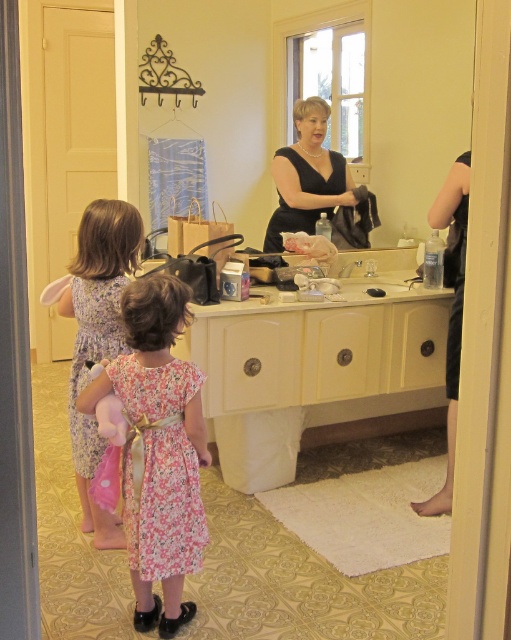
Does point (145, 280) come closer to viewer compared to point (280, 179)?

Yes, it is.

Who is positioned more to the left, floral cotton dress at center or black satin dress at center?

Positioned to the left is floral cotton dress at center.

Who is more forward, [160,472] or [314,154]?

Point [160,472] is in front.

This screenshot has height=640, width=511. Identify the location of floral cotton dress at center. (158, 449).

Who is shorter, floral fabric dress at center or floral fabric dress at left?

floral fabric dress at center

Identify the location of floral fabric dress at center. (159, 468).

From the picture: Between black glossy mirror at upper center and black matte dress at right, which one has more height?

With more height is black glossy mirror at upper center.

Is black glossy mirror at upper center positioned at the back of black matte dress at right?

Yes, it is behind black matte dress at right.

Where is `black glossy mirror at upper center`? The width and height of the screenshot is (511, 640). black glossy mirror at upper center is located at coordinates (222, 96).